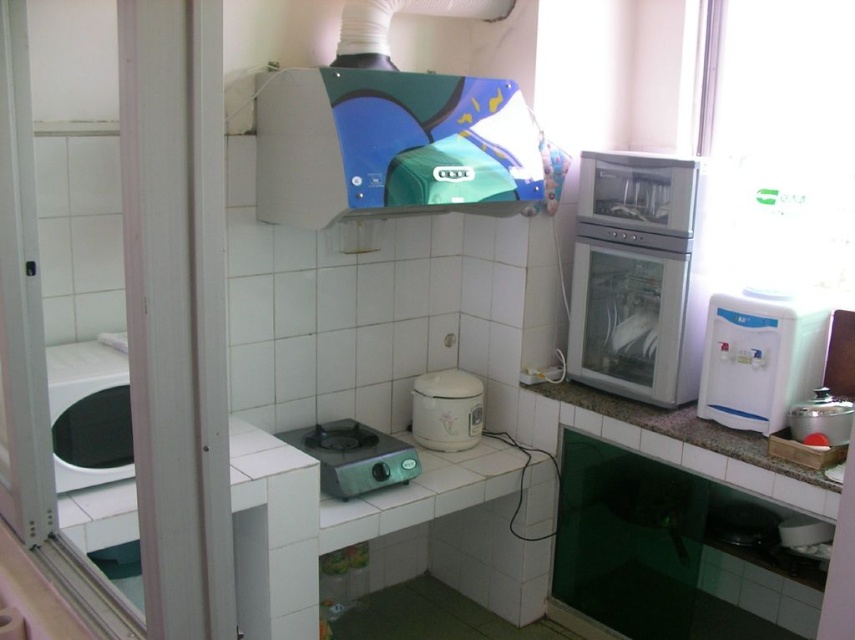
You are trying to clean your dishes in the kitchen. You see the black glossy washing machine at left and the white matte rice cooker at center. Which one should you use for washing dishes?

The black glossy washing machine at left is the correct appliance for washing dishes, as it is a dishwashing machine. The white matte rice cooker at center is for cooking rice.

You are a kitchen designer planning to install a new microwave above the stove. The microwave requires a mounting bracket that must be placed at coordinates between 0.2 and 0.3 on the x and y axes. Can the blue glossy exhaust hood at upper center interfere with this installation?

The blue glossy exhaust hood at upper center is located at coordinates point (390,145). Since the microwave bracket requires placement between 0.2 and 0.3 on both axes, the exhaust hood is within the x range but exceeds the y range. Therefore, the exhaust hood may interfere with the installation as its y coordinate is higher than 0.3.